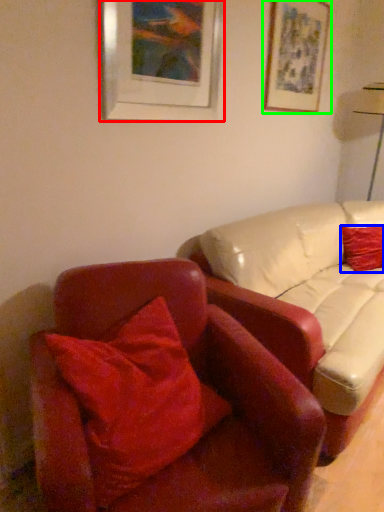
Question: Which is farther away from picture frame (highlighted by a red box)? pillow (highlighted by a blue box) or picture frame (highlighted by a green box)?

Choices:
 (A) pillow
 (B) picture frame

Answer: (A)